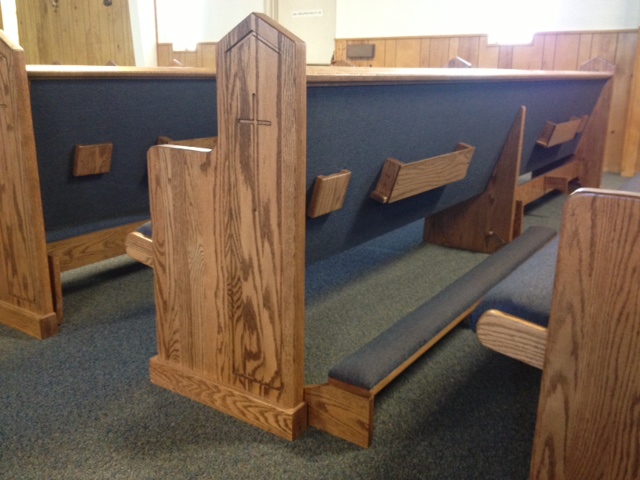
Image resolution: width=640 pixels, height=480 pixels. What are the coordinates of `window` in the screenshot? It's located at (515, 34).